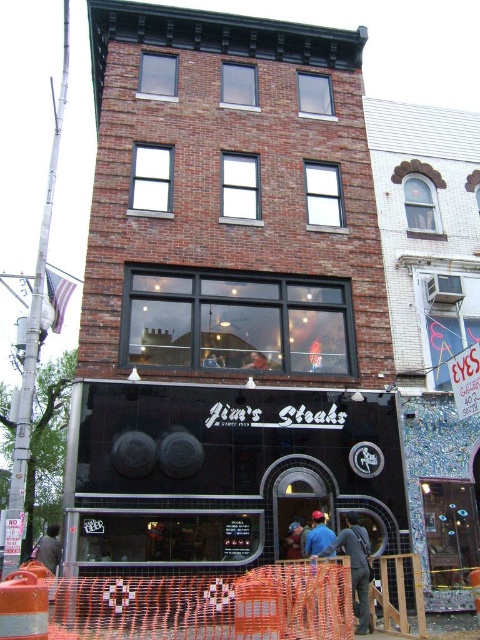
Question: Which point is closer to the camera?

Choices:
 (A) black glass storefront at center
 (B) dark gray fabric construction worker at lower center

Answer: (B)

Question: Can you confirm if black glass storefront at center is positioned to the left of dark gray fabric construction worker at lower center?

Choices:
 (A) no
 (B) yes

Answer: (B)

Question: Is black glass storefront at center bigger than dark gray fabric construction worker at lower center?

Choices:
 (A) no
 (B) yes

Answer: (B)

Question: Does black glass storefront at center appear on the right side of dark gray fabric construction worker at lower center?

Choices:
 (A) no
 (B) yes

Answer: (A)

Question: Which point is closer to the camera?

Choices:
 (A) dark gray fabric construction worker at lower center
 (B) black glass storefront at center

Answer: (A)